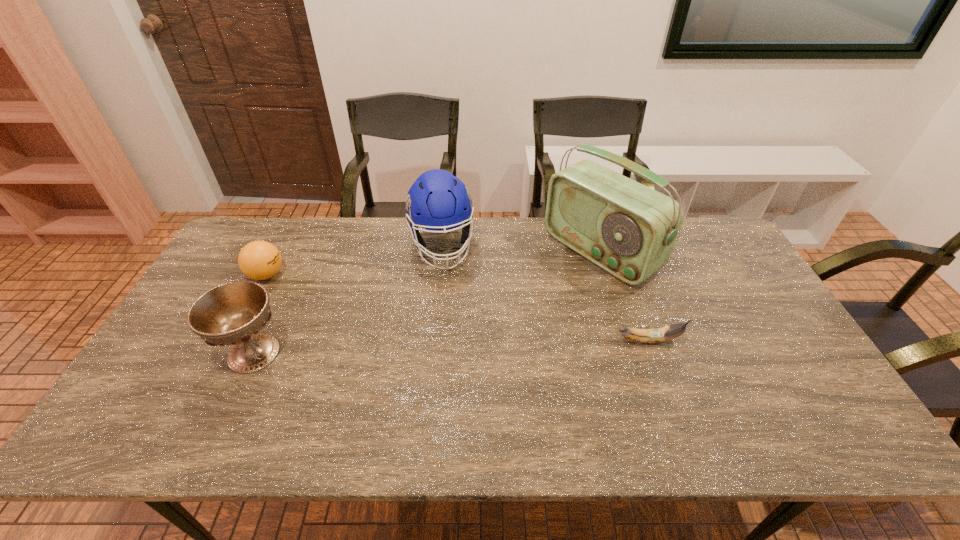
I want to click on vacant spot on the desktop that is between the third tallest object and the shortest object and is positioned on the front panel of the radio receiver, so click(x=459, y=347).

Locate an element on the screen. vacant space on the desktop that is between the third shortest object and the shortest object and is positioned on the side with brand of the ping-pong ball is located at coordinates (405, 348).

You are a GUI agent. You are given a task and a screenshot of the screen. Output one action in this format:
    pyautogui.click(x=<x>, y=<y>)
    Task: Click on the vacant spot on the desktop that is between the chalice and the banana and is positioned on the front-facing side of the second tallest object
    This screenshot has width=960, height=540.
    Given the screenshot: What is the action you would take?
    (462, 346)